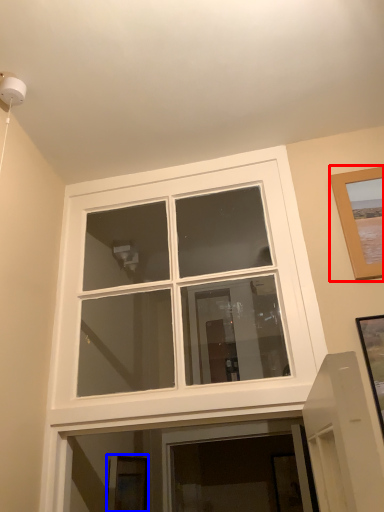
Question: Among these objects, which one is nearest to the camera, picture frame (highlighted by a red box) or picture frame (highlighted by a blue box)?

Choices:
 (A) picture frame
 (B) picture frame

Answer: (A)